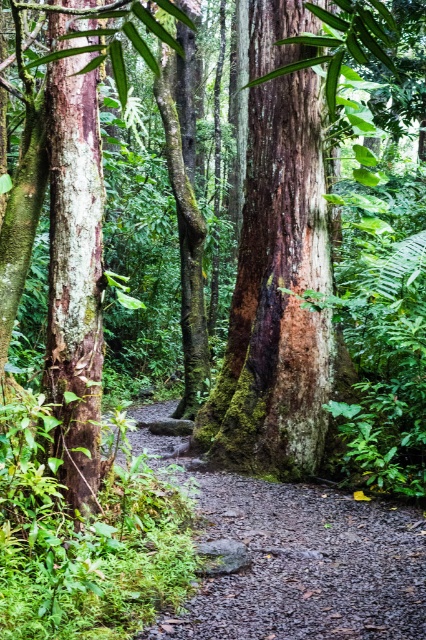
Which is more to the right, smooth brown bark at center or smooth bark tree trunk at left?

smooth brown bark at center is more to the right.

Does smooth brown bark at center appear over smooth bark tree trunk at left?

Correct, smooth brown bark at center is located above smooth bark tree trunk at left.

Which is in front, point (241, 317) or point (86, 140)?

Point (86, 140)

You are a GUI agent. You are given a task and a screenshot of the screen. Output one action in this format:
    pyautogui.click(x=<x>, y=<y>)
    Task: Click on the smooth brown bark at center
    The image size is (426, 640).
    Given the screenshot: What is the action you would take?
    (276, 296)

Who is positioned more to the left, smooth brown bark at center or damp gravel path at center?

smooth brown bark at center is more to the left.

Can you confirm if smooth brown bark at center is wider than damp gravel path at center?

In fact, smooth brown bark at center might be narrower than damp gravel path at center.

Image resolution: width=426 pixels, height=640 pixels. Identify the location of smooth brown bark at center. (276, 296).

Who is higher up, damp gravel path at center or smooth bark tree trunk at left?

smooth bark tree trunk at left is above.

Between point (265, 620) and point (74, 445), which one is positioned in front?

Positioned in front is point (265, 620).

This screenshot has width=426, height=640. What do you see at coordinates (301, 563) in the screenshot?
I see `damp gravel path at center` at bounding box center [301, 563].

Where is `damp gravel path at center`? Image resolution: width=426 pixels, height=640 pixels. damp gravel path at center is located at coordinates (301, 563).